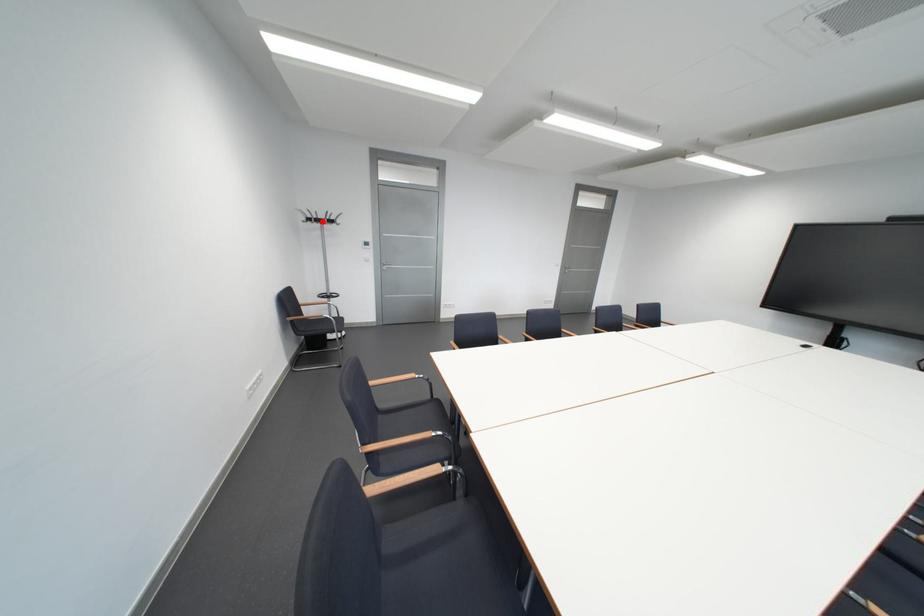
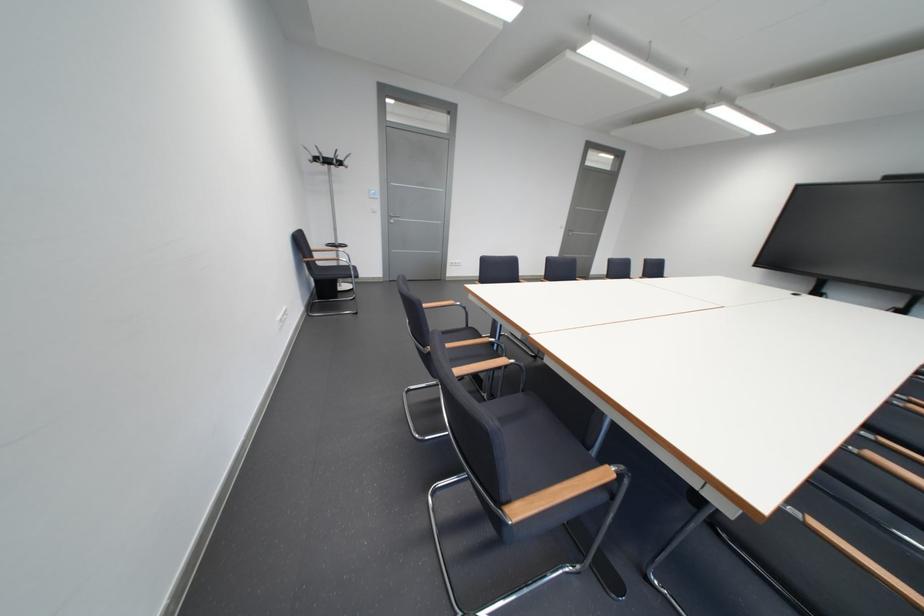
Question: I am providing you with two images of the same scene from different viewpoints. Given a red point in image1, look at the same physical point in image2. Is it:

Choices:
 (A) Closer to the viewpoint
 (B) Farther from the viewpoint

Answer: (A)